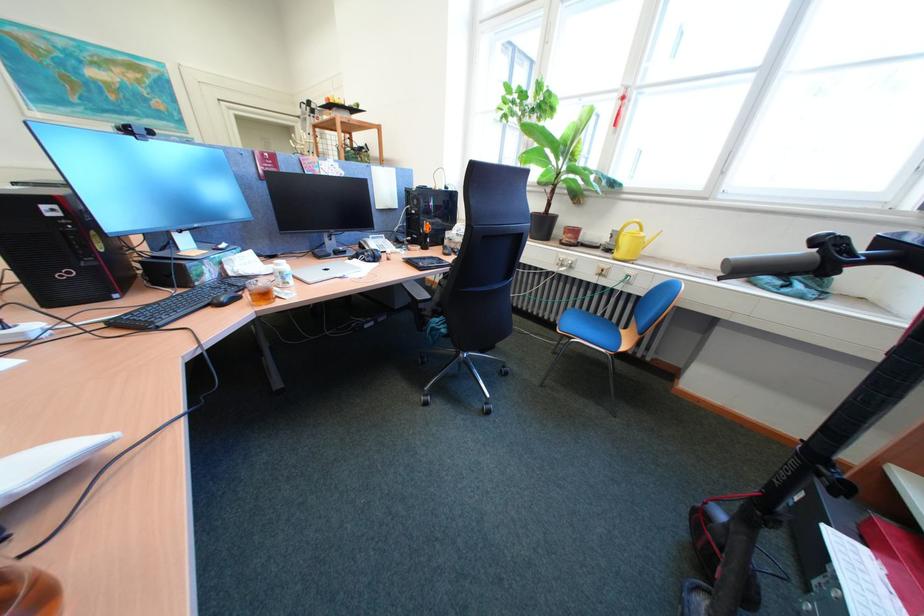
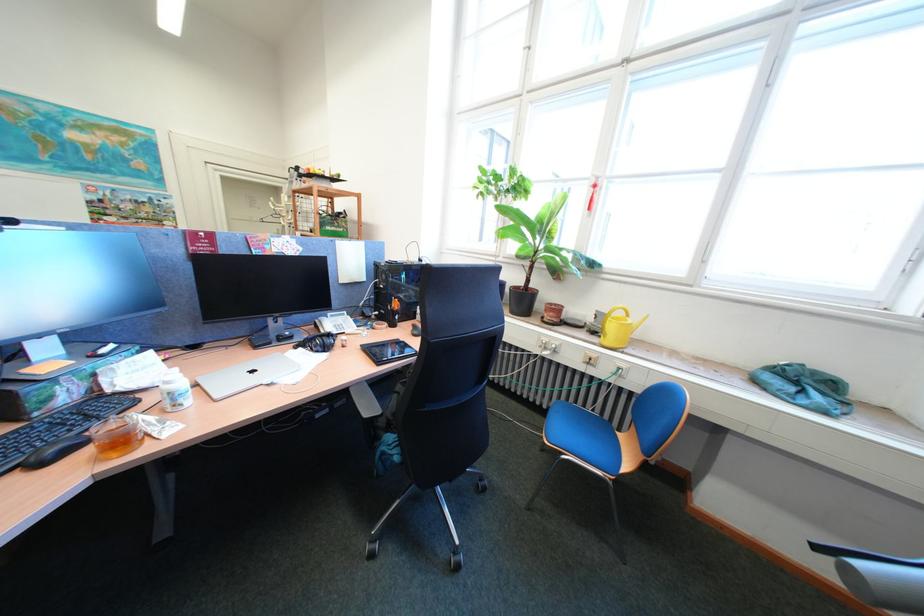
Where in the second image is the point corresponding to pixel 297 280 from the first image?

(187, 402)